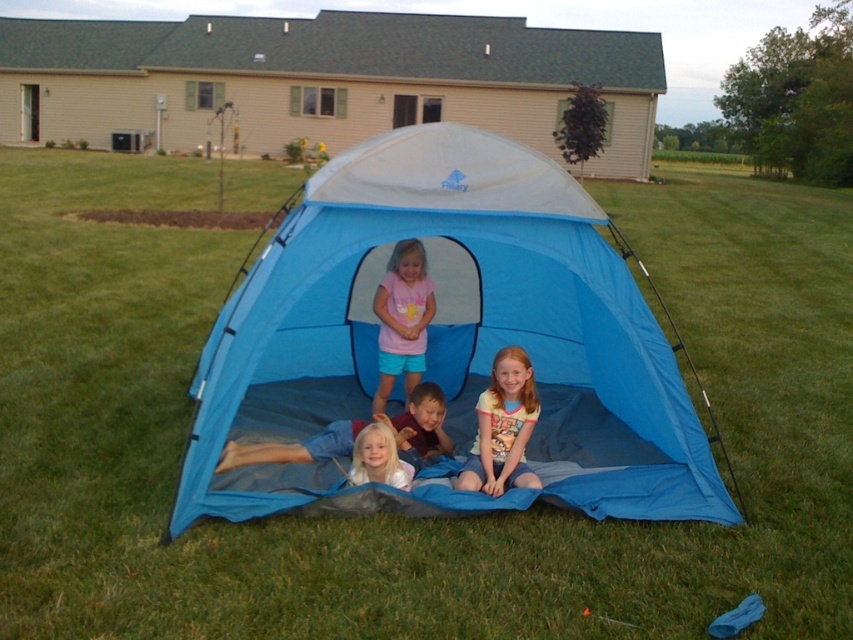
Question: Which of the following is the farthest from the observer?

Choices:
 (A) (492, 396)
 (B) (448, 200)
 (C) (345, 422)

Answer: (C)

Question: Does light pink cotton shirt at center have a lesser width compared to blonde hair at center?

Choices:
 (A) no
 (B) yes

Answer: (A)

Question: Can you confirm if light pink cotton shirt at center is thinner than smooth blue blanket at center?

Choices:
 (A) no
 (B) yes

Answer: (B)

Question: Can you confirm if blue fabric tent at center is positioned to the left of blonde hair at center?

Choices:
 (A) no
 (B) yes

Answer: (A)

Question: Among these points, which one is farthest from the camera?

Choices:
 (A) (387, 474)
 (B) (396, 432)

Answer: (B)

Question: Which point is farther from the camera taking this photo?

Choices:
 (A) (442, 445)
 (B) (535, 474)

Answer: (A)